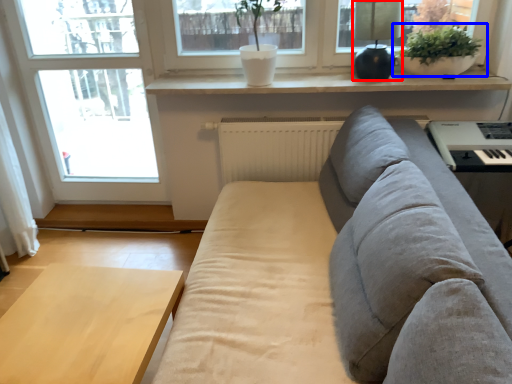
Question: Which of the following is the closest to the observer, lamp (highlighted by a red box) or houseplant (highlighted by a blue box)?

Choices:
 (A) lamp
 (B) houseplant

Answer: (A)